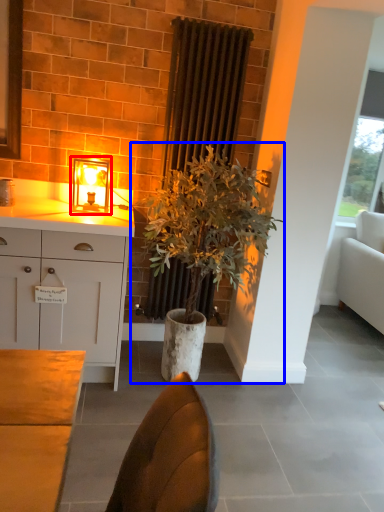
Question: Which object appears farthest to the camera in this image, table lamp (highlighted by a red box) or houseplant (highlighted by a blue box)?

Choices:
 (A) table lamp
 (B) houseplant

Answer: (A)